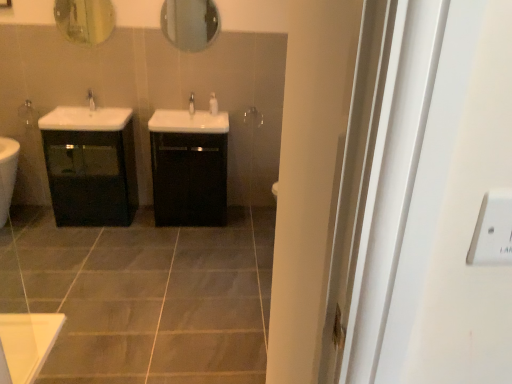
You are a GUI agent. You are given a task and a screenshot of the screen. Output one action in this format:
    pyautogui.click(x=<x>, y=<y>)
    Task: Click on the free space to the left of matte black cabinet at left, the first bathroom cabinet positioned from the left
    This screenshot has width=512, height=384.
    Given the screenshot: What is the action you would take?
    pyautogui.click(x=31, y=225)